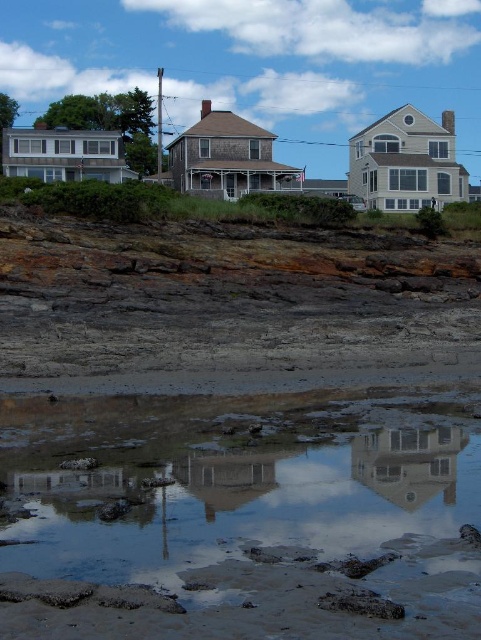
You are standing on the rocky shoreline and want to reach the white glossy house at center. Based on the clear water at lower center, can you estimate how far the house is from the shoreline?

The clear water at lower center has a larger size compared to the white glossy house at center, which suggests that the house is farther away from the shoreline since the water area is more extensive.

You are standing on the rocky shoreline and want to see which object in the scene is taller. You notice the clear water at lower center and the white glossy house at center. Which one has a greater height?

The clear water at lower center has a greater height compared to the white glossy house at center according to the description.

Looking at this image, you are a photographer standing on the rocky shoreline and want to capture both the clear water at lower center and the white glossy house at center in a single shot. Based on their positions, which object will appear closer to the camera in your photo?

The clear water at lower center will appear closer to the camera because it is positioned in front of the white glossy house at center.